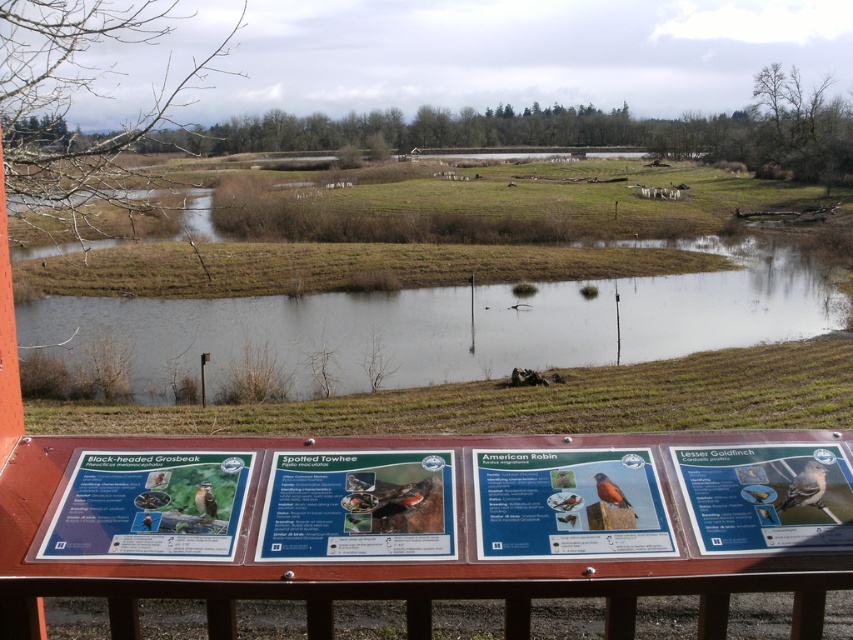
How much distance is there between green cardstock sign at center and orange-brown bird at center?

The distance of green cardstock sign at center from orange-brown bird at center is 61.36 centimeters.

Is point (357, 460) closer to viewer compared to point (614, 484)?

No, (357, 460) is further to viewer.

Where is `green cardstock sign at center`? Image resolution: width=853 pixels, height=640 pixels. green cardstock sign at center is located at coordinates (358, 506).

At what (x,y) coordinates should I click in order to perform the action: click on green cardstock sign at center. Please return your answer as a coordinate pair (x, y). Looking at the image, I should click on (358, 506).

Based on the photo, which of these two, clear water at center or matte plastic sign at lower left, stands taller?

With more height is clear water at center.

Does clear water at center appear over matte plastic sign at lower left?

Indeed, clear water at center is positioned over matte plastic sign at lower left.

Locate an element on the screen. This screenshot has width=853, height=640. clear water at center is located at coordinates (456, 323).

Which of these two, matte plastic american robin sign at center or brown feathered bird at lower left, stands shorter?

With less height is brown feathered bird at lower left.

Does matte plastic american robin sign at center lie behind brown feathered bird at lower left?

No, it is not.

Is point (498, 456) closer to viewer compared to point (199, 492)?

No, (498, 456) is behind (199, 492).

This screenshot has height=640, width=853. I want to click on matte plastic american robin sign at center, so click(x=569, y=502).